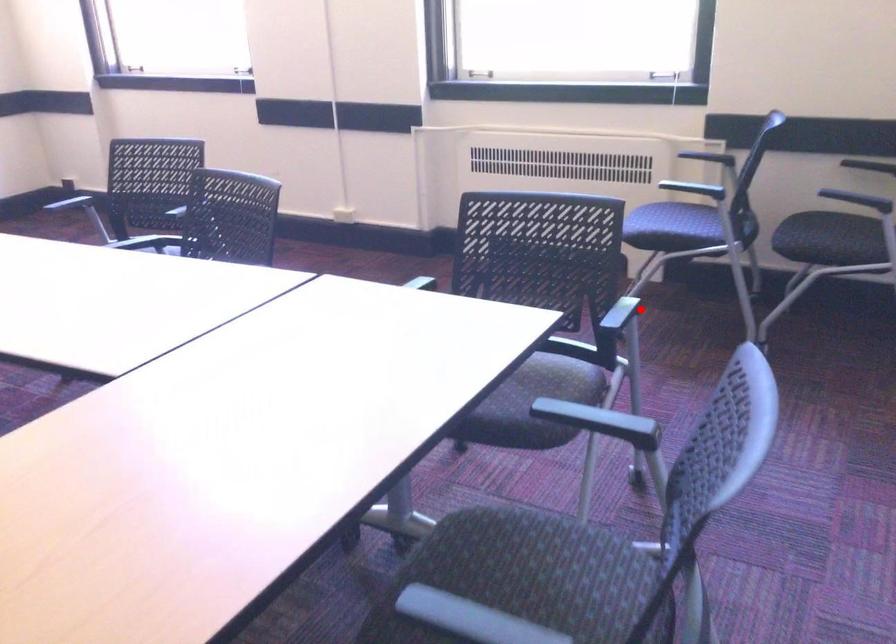
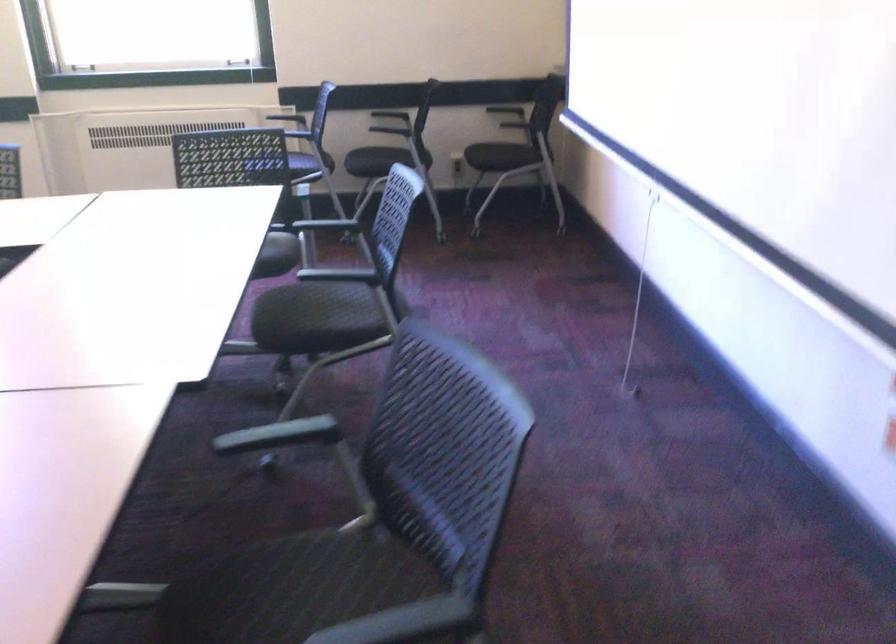
Question: I am providing you with two images of the same scene from different viewpoints. A red point is marked on the first image. Is the red point's position out of view in image 2?

Choices:
 (A) Yes
 (B) No

Answer: (A)